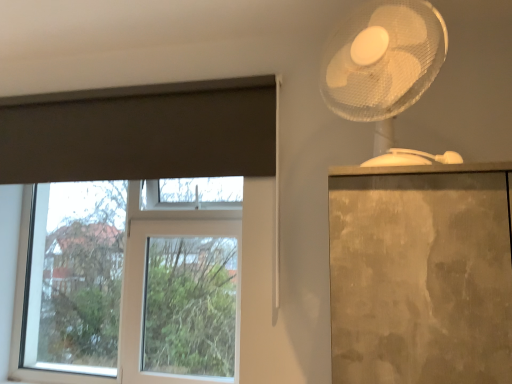
Question: Considering the positions of point (268, 96) and point (184, 248), is point (268, 96) closer or farther from the camera than point (184, 248)?

Choices:
 (A) farther
 (B) closer

Answer: (B)

Question: From a real-world perspective, is dark gray matte curtain at upper left physically located above or below clear glass window at left?

Choices:
 (A) below
 (B) above

Answer: (B)

Question: Which object is positioned closest to the dark gray matte curtain at upper left?

Choices:
 (A) white plastic fan at upper right
 (B) clear glass window at left

Answer: (B)

Question: Which of these objects is positioned farthest from the dark gray matte curtain at upper left?

Choices:
 (A) clear glass window at left
 (B) white plastic fan at upper right

Answer: (B)